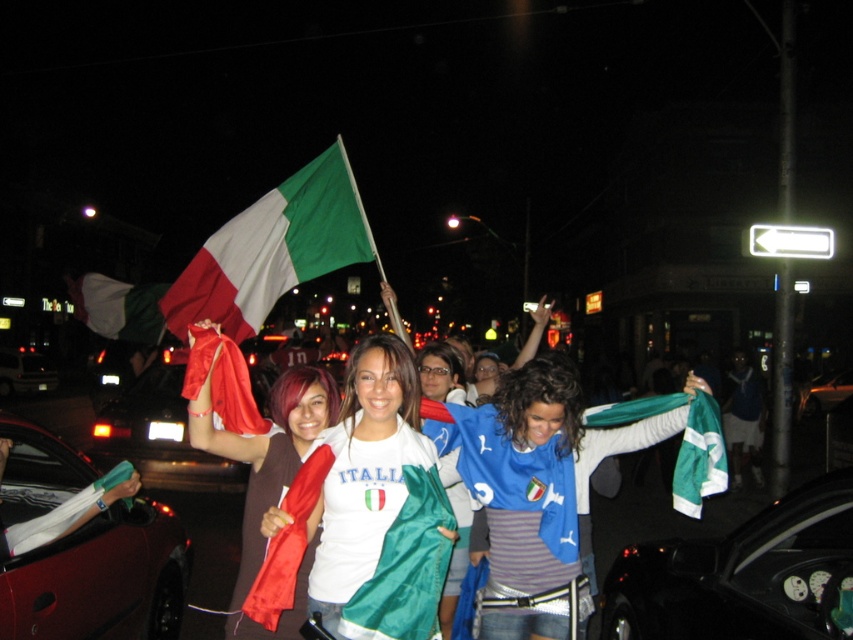
Question: Which point is farther to the camera?

Choices:
 (A) (149, 307)
 (B) (817, 388)
 (C) (346, 404)

Answer: (B)

Question: Does metallic red car at center appear over metallic silver car at left?

Choices:
 (A) no
 (B) yes

Answer: (B)

Question: Which of the following is the closest to the observer?

Choices:
 (A) (368, 387)
 (B) (628, 432)
 (C) (21, 609)
 (D) (85, 307)

Answer: (A)

Question: Which point is closer to the camera?

Choices:
 (A) (347, 369)
 (B) (837, 392)

Answer: (A)

Question: In this image, where is metallic red car at center located relative to green-white-red fabric flag at center?

Choices:
 (A) below
 (B) above

Answer: (A)

Question: Can you confirm if white matte shirt at center is positioned below metallic silver car at left?

Choices:
 (A) no
 (B) yes

Answer: (A)